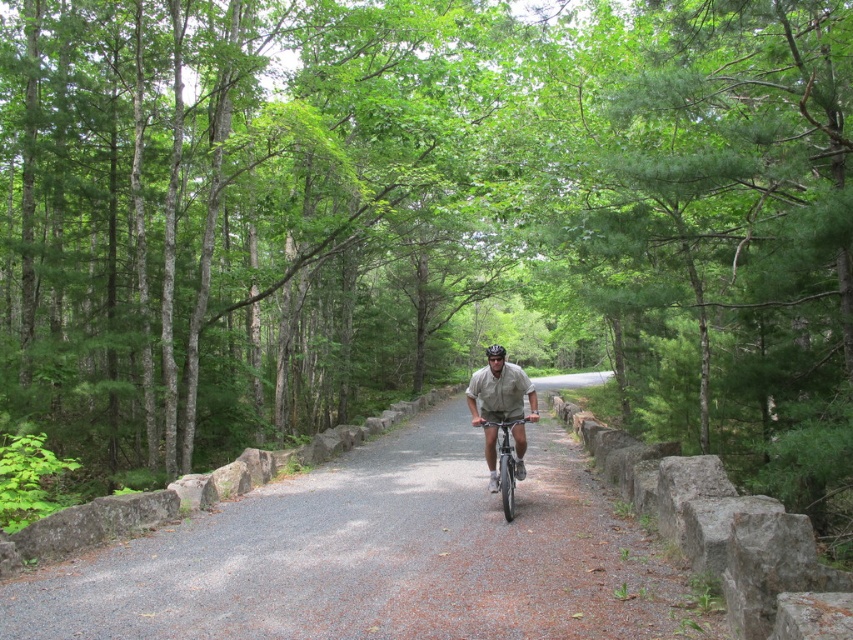
Does gray gravel path at center have a lesser height compared to silver metallic bicycle at center?

Yes, gray gravel path at center is shorter than silver metallic bicycle at center.

Is point (0, 636) positioned behind point (512, 461)?

That is False.

Describe the element at coordinates (380, 556) in the screenshot. I see `gray gravel path at center` at that location.

This screenshot has height=640, width=853. I want to click on gray gravel path at center, so click(x=380, y=556).

Does gray gravel path at center have a lesser width compared to black matte bicycle helmet at center?

No, gray gravel path at center is not thinner than black matte bicycle helmet at center.

This screenshot has width=853, height=640. Find the location of `gray gravel path at center`. gray gravel path at center is located at coordinates (380, 556).

Who is shorter, silver metallic bicycle at center or black matte bicycle helmet at center?

Standing shorter between the two is black matte bicycle helmet at center.

Does silver metallic bicycle at center have a smaller size compared to black matte bicycle helmet at center?

Yes, silver metallic bicycle at center is smaller than black matte bicycle helmet at center.

Where is `silver metallic bicycle at center`? silver metallic bicycle at center is located at coordinates (506, 461).